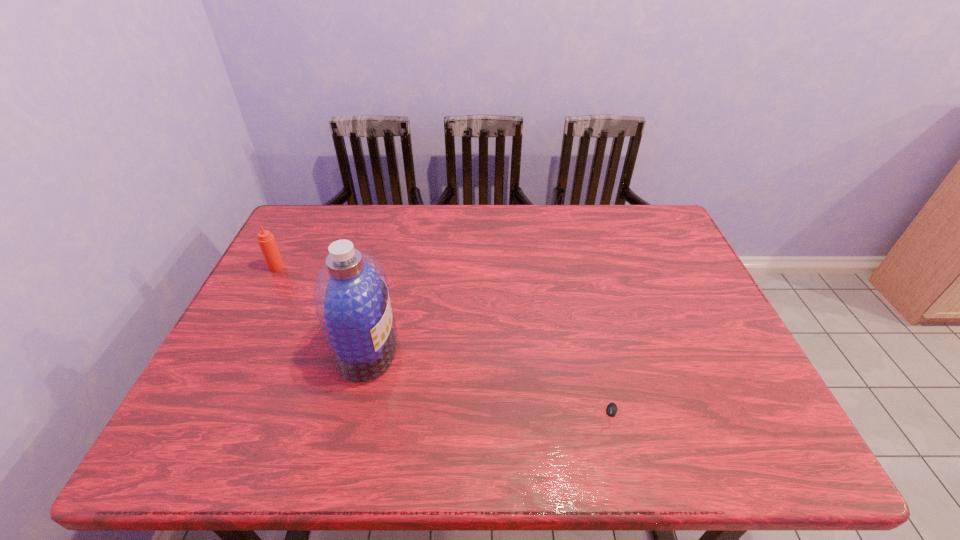
The height and width of the screenshot is (540, 960). Identify the location of free point between the rightmost object and the second farthest object. (488, 383).

Identify the location of free space between the nearest object and the farthest object. (443, 342).

Where is `free space that is in between the farthest object and the rightmost object`? free space that is in between the farthest object and the rightmost object is located at coordinates (443, 342).

The width and height of the screenshot is (960, 540). What are the coordinates of `free space between the second shortest object and the shortest object` in the screenshot? It's located at (443, 342).

Identify which object is located as the nearest to the nearest object. Please provide its 2D coordinates. Your answer should be formatted as a tuple, i.e. [(x, y)], where the tuple contains the x and y coordinates of a point satisfying the conditions above.

[(351, 298)]

Identify which object is located as the nearest to the second tallest object. Please provide its 2D coordinates. Your answer should be formatted as a tuple, i.e. [(x, y)], where the tuple contains the x and y coordinates of a point satisfying the conditions above.

[(351, 298)]

What are the coordinates of `vacant region that satisfies the following two spatial constraints: 1. on the front side of the second tallest object; 2. on the right side of the mouse` in the screenshot? It's located at (198, 418).